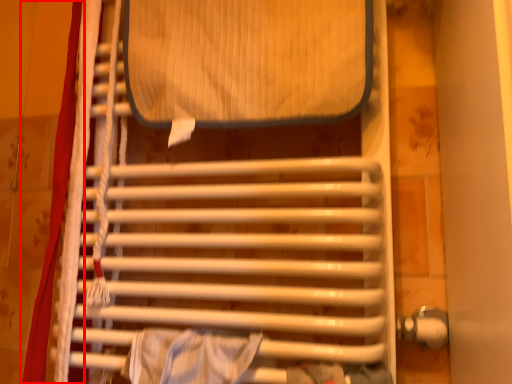
Question: From the image's perspective, what is the correct spatial relationship of curtain (annotated by the red box) in relation to furniture?

Choices:
 (A) below
 (B) above

Answer: (A)